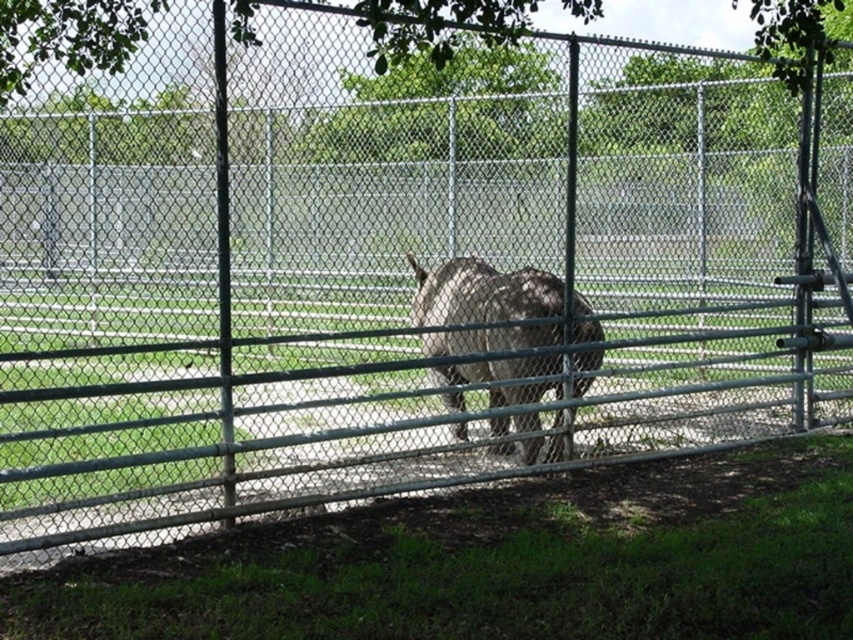
Question: Which point is closer to the camera?

Choices:
 (A) green leafy tree at upper center
 (B) gray fur at center

Answer: (A)

Question: Is green leafy tree at upper center below gray fur at center?

Choices:
 (A) no
 (B) yes

Answer: (A)

Question: Does green leafy tree at upper center have a smaller size compared to gray fur at center?

Choices:
 (A) no
 (B) yes

Answer: (B)

Question: In this image, where is green leafy tree at upper center located relative to gray fur at center?

Choices:
 (A) above
 (B) below

Answer: (A)

Question: Which object appears closest to the camera in this image?

Choices:
 (A) gray fur at center
 (B) green leafy tree at upper center

Answer: (B)